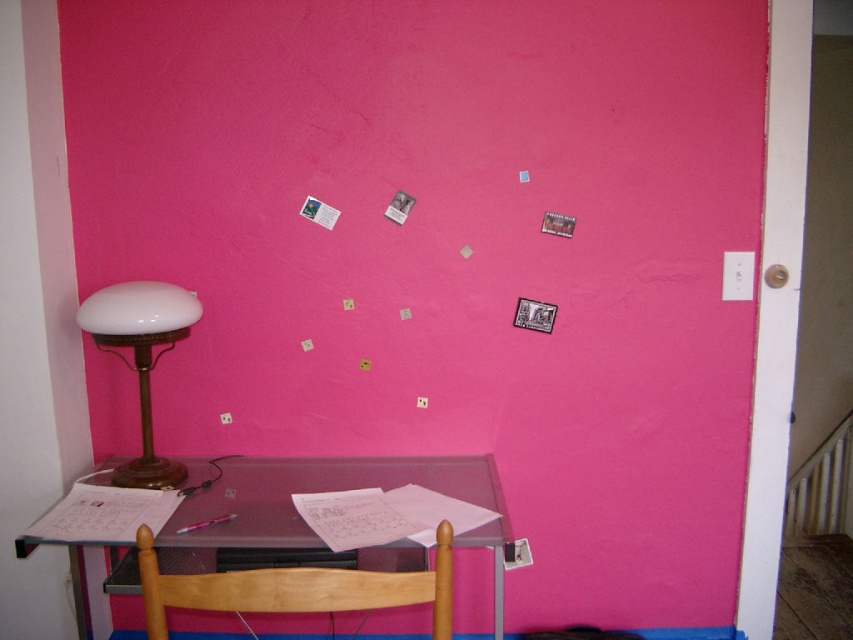
You are sitting in the wooden chair at lower center and want to turn on the white opaline glass lampshade at left. Can you reach it without moving from your seat?

The wooden chair at lower center is closer to the viewer than the white opaline glass lampshade at left, so you are farther away from the lampshade. Therefore, you might not be able to reach it without moving from your seat.

You are standing at the point marked as point (x=485, y=488). You need to place a new item exactly 6 feet away from this point on the pink wall. Is this possible?

The distance between the point (x=485, y=488) and the pink wall is 5.95 feet, which is slightly less than 6 feet. Therefore, placing an item exactly 6 feet away from this point on the pink wall is not possible as the wall is closer than the required distance.